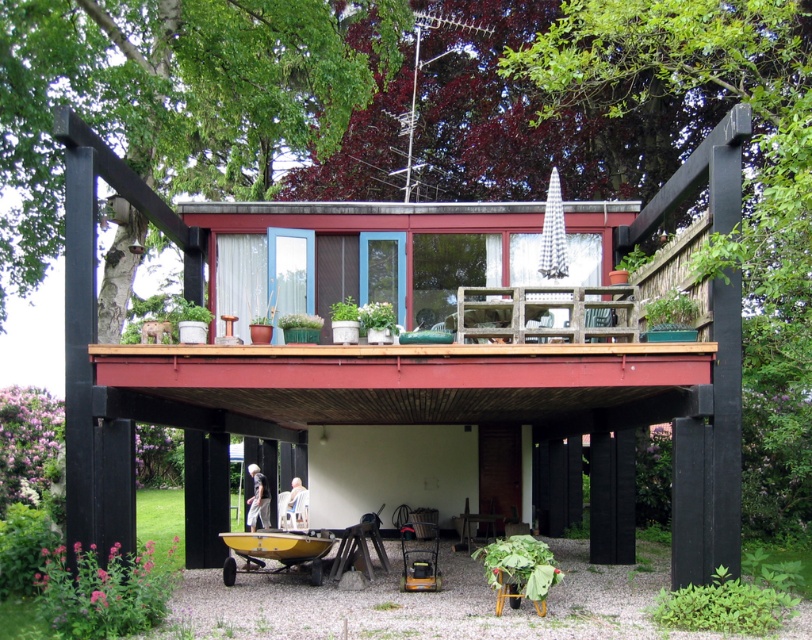
Between point (296, 529) and point (262, 513), which one is positioned in front?

Point (296, 529) is more forward.

Which of these two, white fabric chair at lower center or light gray fabric pants at lower center, stands shorter?

white fabric chair at lower center is shorter.

The width and height of the screenshot is (812, 640). Find the location of `white fabric chair at lower center`. white fabric chair at lower center is located at coordinates (292, 506).

Find the location of a particular element. white fabric chair at lower center is located at coordinates (292, 506).

Is point (530, 218) positioned after point (264, 476)?

No, it is not.

Is black wood pergola at center to the right of light gray fabric pants at lower center from the viewer's perspective?

Yes, black wood pergola at center is to the right of light gray fabric pants at lower center.

Is point (121, 442) positioned in front of point (249, 467)?

Yes, point (121, 442) is closer to viewer.

Where is `black wood pergola at center`? black wood pergola at center is located at coordinates (404, 381).

Between black wood pergola at center and white fabric chair at lower center, which one has more height?

Standing taller between the two is black wood pergola at center.

Is black wood pergola at center smaller than white fabric chair at lower center?

Actually, black wood pergola at center might be larger than white fabric chair at lower center.

Image resolution: width=812 pixels, height=640 pixels. Describe the element at coordinates (404, 381) in the screenshot. I see `black wood pergola at center` at that location.

I want to click on black wood pergola at center, so [404, 381].